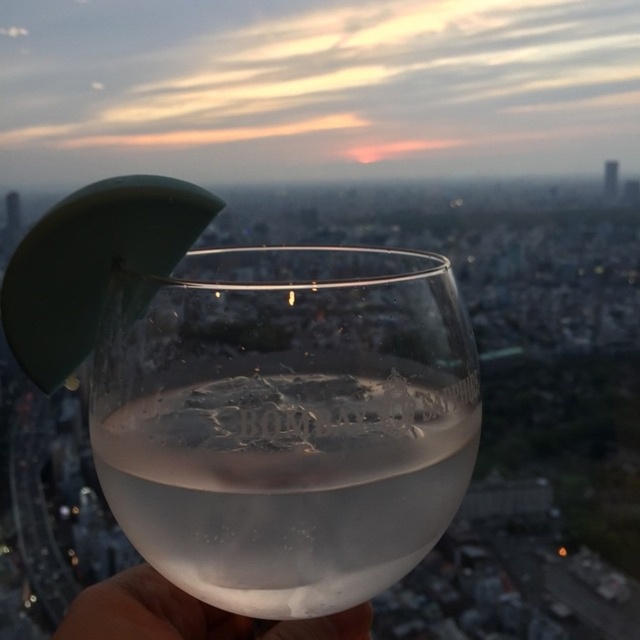
Is point (124, 294) farther from viewer compared to point (152, 588)?

No, it is in front of (152, 588).

Based on the photo, does clear glass at center have a lesser width compared to white matte hand at lower left?

In fact, clear glass at center might be wider than white matte hand at lower left.

Is point (216, 413) less distant than point (100, 595)?

Yes.

Where is `clear glass at center`? This screenshot has height=640, width=640. clear glass at center is located at coordinates (285, 420).